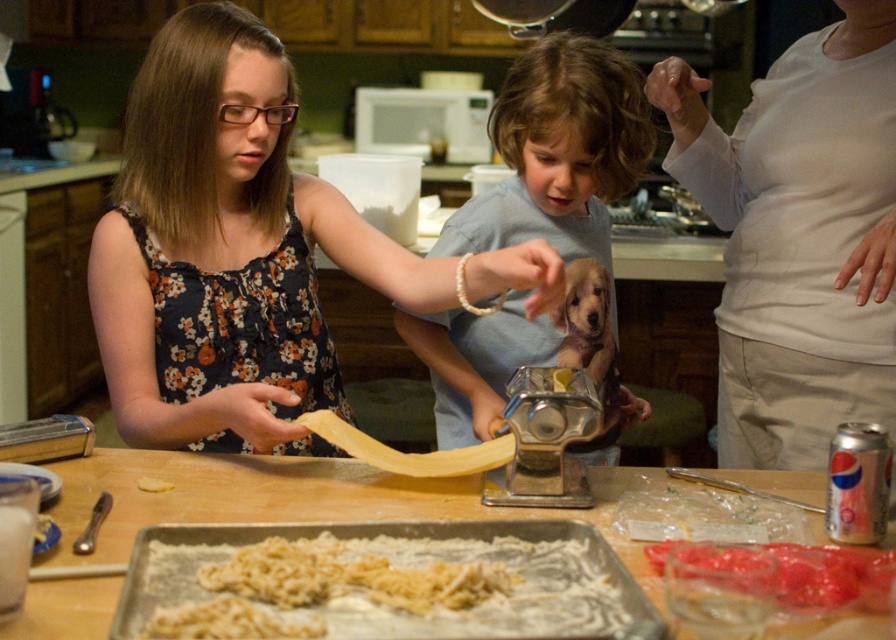
I want to click on floral fabric dress at upper left, so click(x=242, y=252).

Who is more forward, (388, 294) or (332, 560)?

Point (332, 560) is in front.

At what (x,y) coordinates should I click in order to perform the action: click on floral fabric dress at upper left. Please return your answer as a coordinate pair (x, y). The width and height of the screenshot is (896, 640). Looking at the image, I should click on (242, 252).

Can you confirm if floral fabric dress at upper left is positioned above yellow matte pasta at center?

Yes.

Is floral fabric dress at upper left further to the viewer compared to yellow matte pasta at center?

No.

Describe the element at coordinates (242, 252) in the screenshot. The width and height of the screenshot is (896, 640). I see `floral fabric dress at upper left` at that location.

Where is `floral fabric dress at upper left`? The height and width of the screenshot is (640, 896). floral fabric dress at upper left is located at coordinates pyautogui.click(x=242, y=252).

Is white crumbly pasta at center positioned in front of translucent plastic container at lower right?

Yes, it is in front of translucent plastic container at lower right.

Which is above, white crumbly pasta at center or translucent plastic container at lower right?

white crumbly pasta at center is above.

I want to click on white crumbly pasta at center, so click(x=350, y=577).